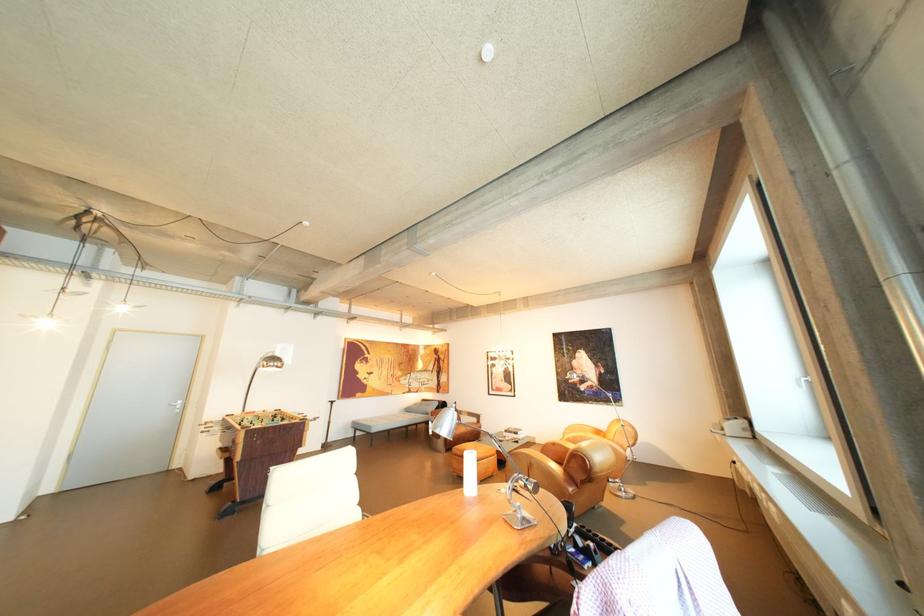
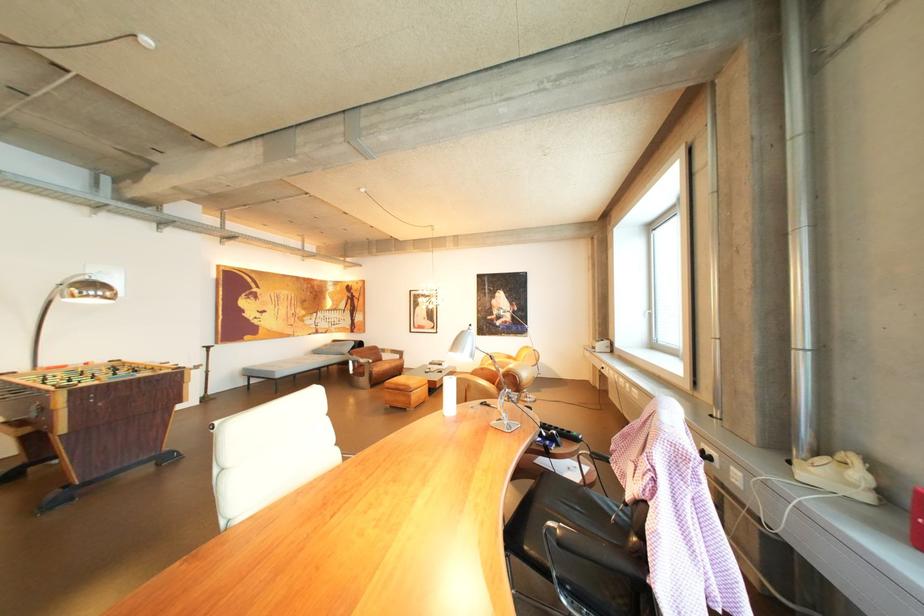
Question: The camera is either moving clockwise (left) or counter-clockwise (right) around the object. The first image is from the beginning of the video and the second image is from the end. Is the camera moving left or right when shooting the video?

Choices:
 (A) Left
 (B) Right

Answer: (A)